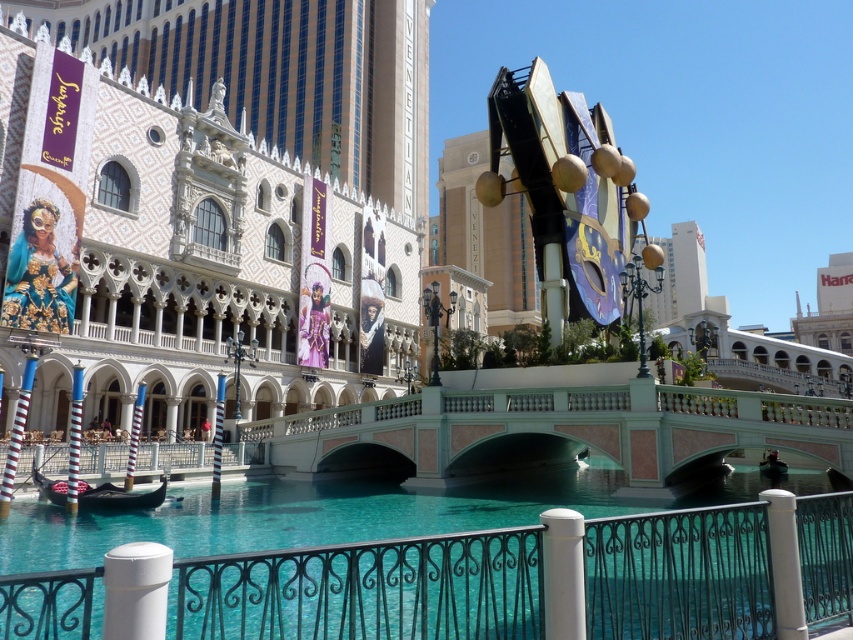
Question: Which of the following is the closest to the observer?

Choices:
 (A) (122, 493)
 (B) (312, 458)
 (C) (306, 176)
 (D) (695, 586)

Answer: (D)

Question: Estimate the real-world distances between objects in this image. Which object is farther from the wooden gondola at lower left?

Choices:
 (A) white glossy building at upper left
 (B) polished stone bridge at center

Answer: (A)

Question: Does white glossy building at upper left appear over clear glass canal at center?

Choices:
 (A) yes
 (B) no

Answer: (A)

Question: Which of the following is the farthest from the observer?

Choices:
 (A) clear glass canal at center
 (B) wooden gondola at lower left
 (C) polished stone bridge at center

Answer: (C)

Question: Is white glossy building at upper left thinner than polished stone bridge at center?

Choices:
 (A) no
 (B) yes

Answer: (A)

Question: Is clear glass canal at center to the left of wooden gondola at lower left from the viewer's perspective?

Choices:
 (A) no
 (B) yes

Answer: (A)